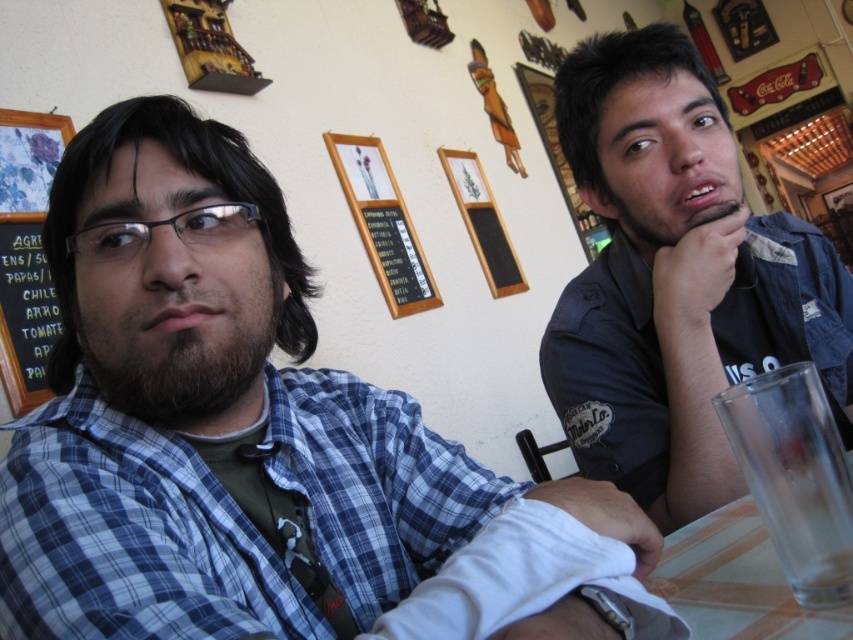
You are a waiter in a restaurant and need to place a new menu on the table between the transparent glass at lower right and the white glossy table at lower right. Which object should you place it closer to?

The transparent glass at lower right is to the left of white glossy table at lower right, so the menu should be placed closer to the white glossy table at lower right to be between them.

You are a photographer trying to capture a group photo of the two people at the table. You notice the blue plaid shirt at left and the dark blue shirt at right. Based on their positions, which shirt might require more space in the frame to avoid being cut off?

The blue plaid shirt at left might require more space in the frame to avoid being cut off since it might be wider than the dark blue shirt at right.